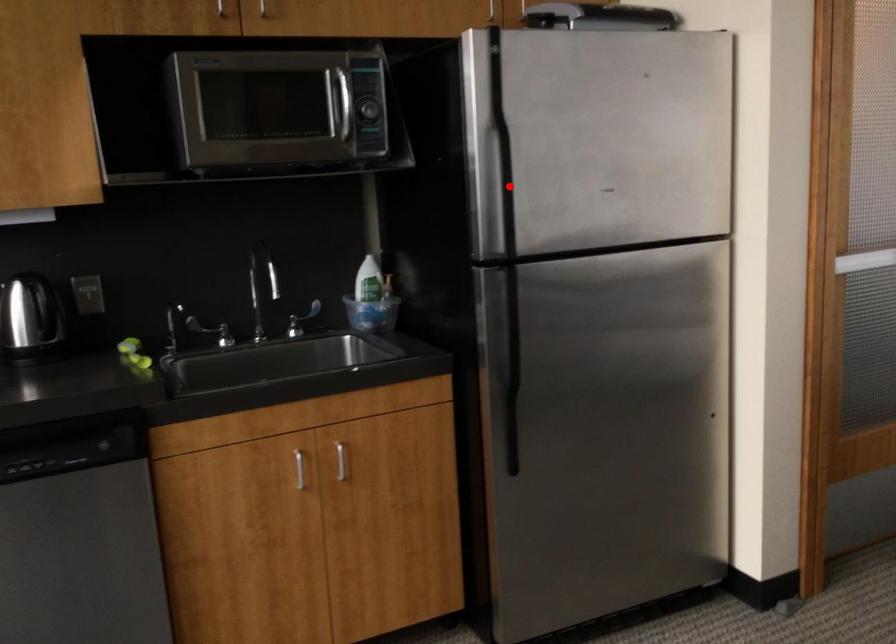
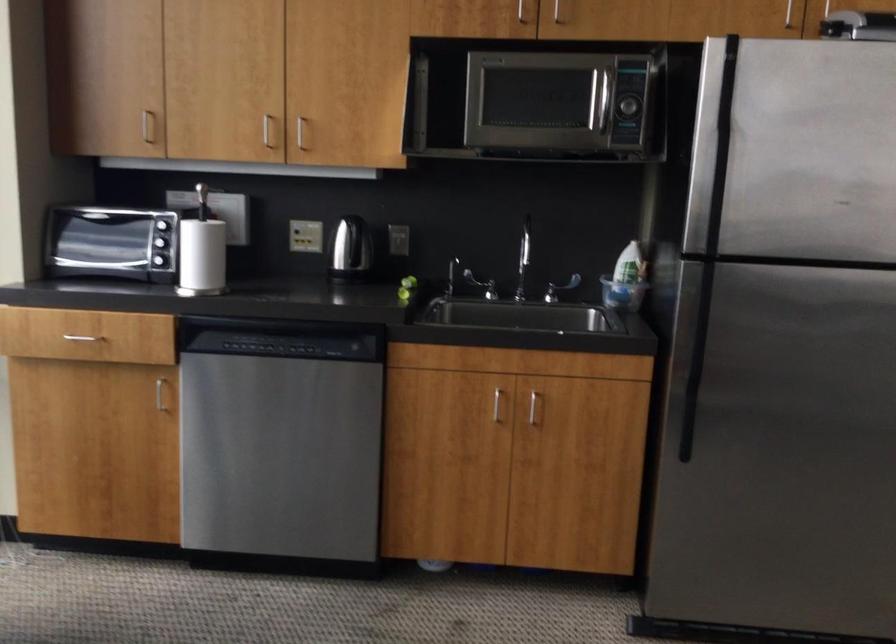
Locate, in the second image, the point that corresponds to the highlighted location in the first image.

(718, 184)